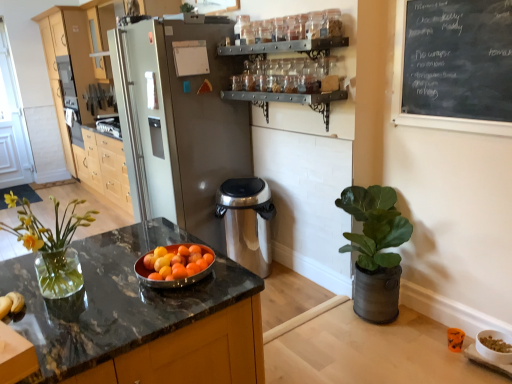
Question: Is clear glass vase at left bigger than green matte plant at right?

Choices:
 (A) no
 (B) yes

Answer: (A)

Question: Is clear glass vase at left taller than green matte plant at right?

Choices:
 (A) yes
 (B) no

Answer: (B)

Question: Considering the relative positions of clear glass vase at left and green matte plant at right in the image provided, is clear glass vase at left to the left of green matte plant at right from the viewer's perspective?

Choices:
 (A) no
 (B) yes

Answer: (B)

Question: From a real-world perspective, does clear glass vase at left sit lower than green matte plant at right?

Choices:
 (A) no
 (B) yes

Answer: (A)

Question: Is clear glass vase at left aimed at green matte plant at right?

Choices:
 (A) no
 (B) yes

Answer: (A)

Question: Does clear glass vase at left have a lesser width compared to green matte plant at right?

Choices:
 (A) yes
 (B) no

Answer: (A)

Question: Is black chalkboard at upper right oriented away from light wood cabinetry at left?

Choices:
 (A) no
 (B) yes

Answer: (A)

Question: Is there a large distance between black chalkboard at upper right and light wood cabinetry at left?

Choices:
 (A) yes
 (B) no

Answer: (A)

Question: Is black chalkboard at upper right touching light wood cabinetry at left?

Choices:
 (A) yes
 (B) no

Answer: (B)

Question: From the image's perspective, is black chalkboard at upper right located beneath light wood cabinetry at left?

Choices:
 (A) no
 (B) yes

Answer: (B)

Question: From the image's perspective, is black chalkboard at upper right over light wood cabinetry at left?

Choices:
 (A) no
 (B) yes

Answer: (A)

Question: Could light wood cabinetry at left be considered to be inside black chalkboard at upper right?

Choices:
 (A) no
 (B) yes

Answer: (A)

Question: Does light wood cabinetry at left have a lesser width compared to stainless steel trash can at center?

Choices:
 (A) no
 (B) yes

Answer: (A)